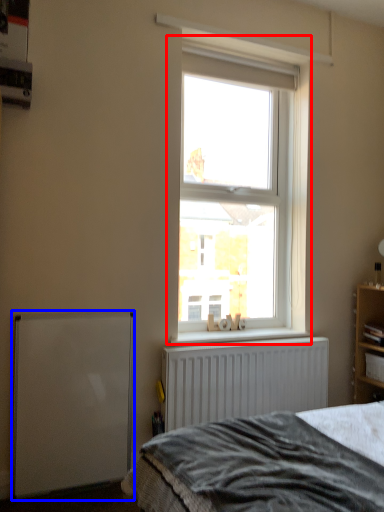
Question: Among these objects, which one is nearest to the camera, window (highlighted by a red box) or wide (highlighted by a blue box)?

Choices:
 (A) window
 (B) wide

Answer: (B)